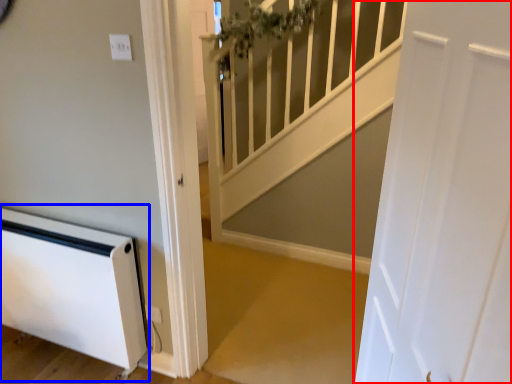
Question: Which object is closer to the camera taking this photo, door (highlighted by a red box) or appliance (highlighted by a blue box)?

Choices:
 (A) door
 (B) appliance

Answer: (A)